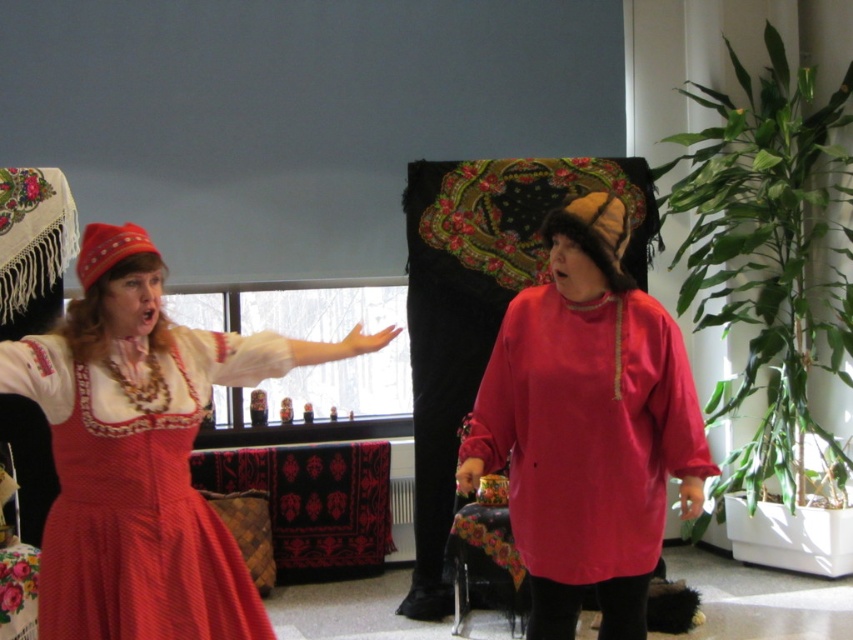
Is matte red blouse at center above matte red dress at left?

Yes, matte red blouse at center is above matte red dress at left.

Who is shorter, matte red blouse at center or matte red dress at left?

Standing shorter between the two is matte red dress at left.

Locate an element on the screen. matte red blouse at center is located at coordinates (587, 426).

This screenshot has height=640, width=853. I want to click on matte red blouse at center, so pos(587,426).